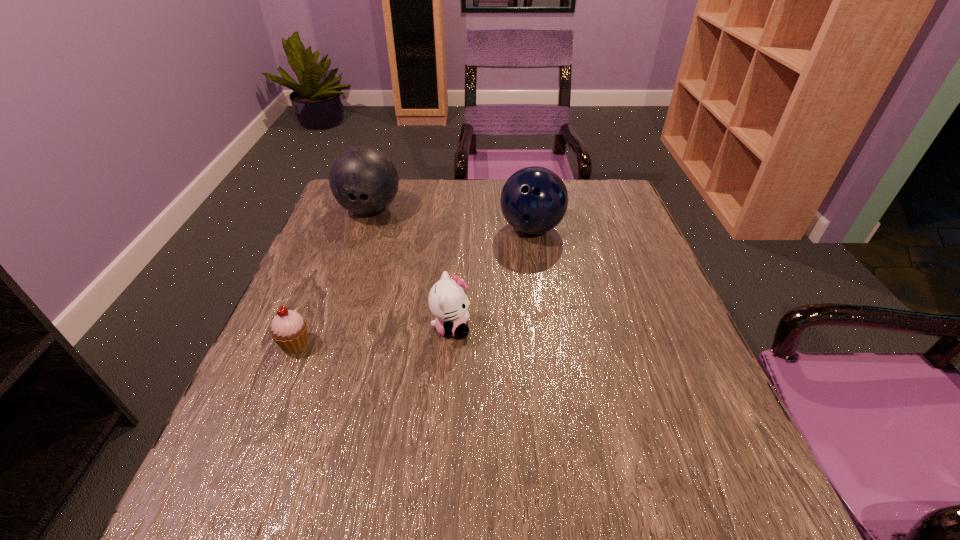
Identify the location of vacant area that lies between the rightmost object and the third tallest object. (492, 278).

Identify the location of vacant region between the shortest object and the kitten. The width and height of the screenshot is (960, 540). (373, 336).

I want to click on free spot between the second shortest object and the right bowling ball, so click(x=492, y=278).

Locate an element on the screen. The height and width of the screenshot is (540, 960). vacant space that's between the left bowling ball and the shortest object is located at coordinates (332, 277).

Identify the location of vacant space in between the kitten and the left bowling ball. (411, 269).

This screenshot has width=960, height=540. Identify the location of free space between the rightmost object and the shortest object. [414, 287].

The image size is (960, 540). What are the coordinates of `vacant space that's between the rightmost object and the left bowling ball` in the screenshot? It's located at (450, 219).

The image size is (960, 540). Find the location of `free spot between the left bowling ball and the kitten`. free spot between the left bowling ball and the kitten is located at coordinates (411, 269).

The width and height of the screenshot is (960, 540). What are the coordinates of `object that ranks as the closest to the cupcake` in the screenshot? It's located at (448, 302).

Locate an element on the screen. The image size is (960, 540). the closest object to the shortest object is located at coordinates (448, 302).